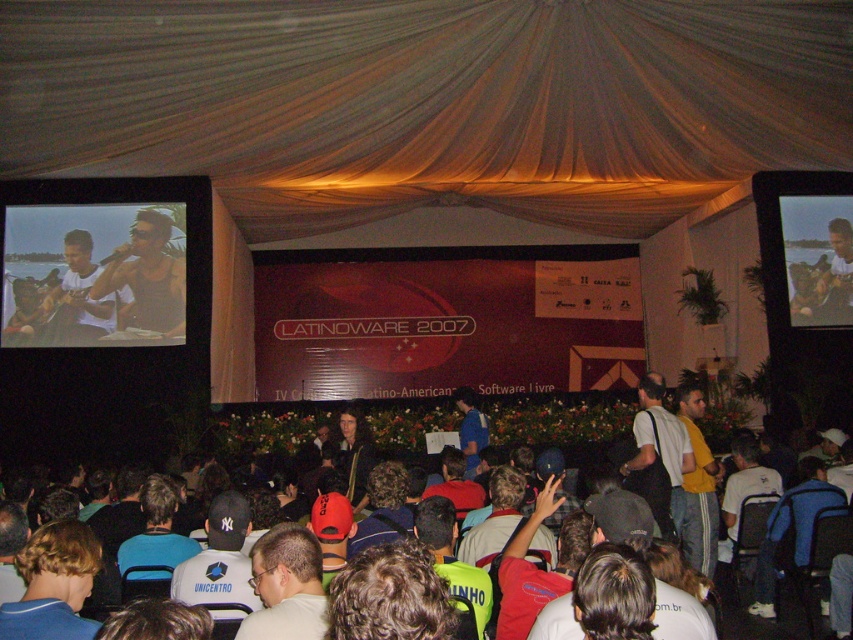
You are an event planner arranging seating for a photo opportunity. You need to position two attendees so that one is in front of the other. Given the current positions of the matte black tank top at upper left and the dark blue shirt at center, which attendee should be placed in front to maintain their relative positions?

The dark blue shirt at center should be placed in front because the matte black tank top at upper left is located above it, meaning the dark blue shirt is lower and closer to the front.

You are a photographer positioned at the camera location. You want to capture a photo of the matte red banner at center without including any audience members. Given that the audience is seated 2 meters in front of the banner, can you adjust your camera angle to frame the banner while excluding the audience?

The matte red banner at center is 13.60 meters away from the camera. Since the audience is seated 2 meters in front of the banner, the total distance between the camera and the audience is 11.60 meters. By adjusting the camera angle to focus on the banner at 13.60 meters, you can exclude the closer audience members, as they are only 11.60 meters away from the camera.